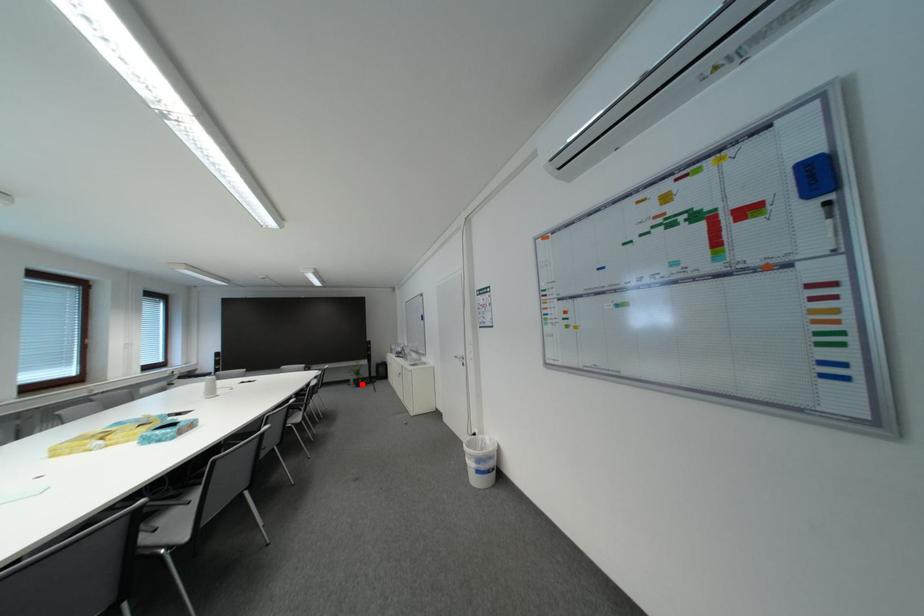
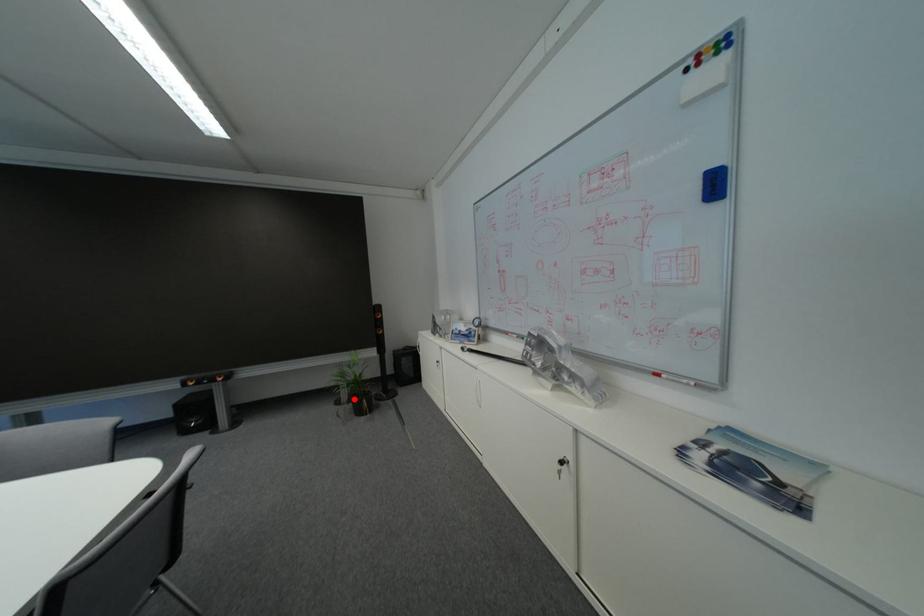
I am providing you with two images of the same scene from different viewpoints. A red point is marked on the first image and another point is marked on the second image. Are the points marked in image1 and image2 representing the same 3D position?

Yes